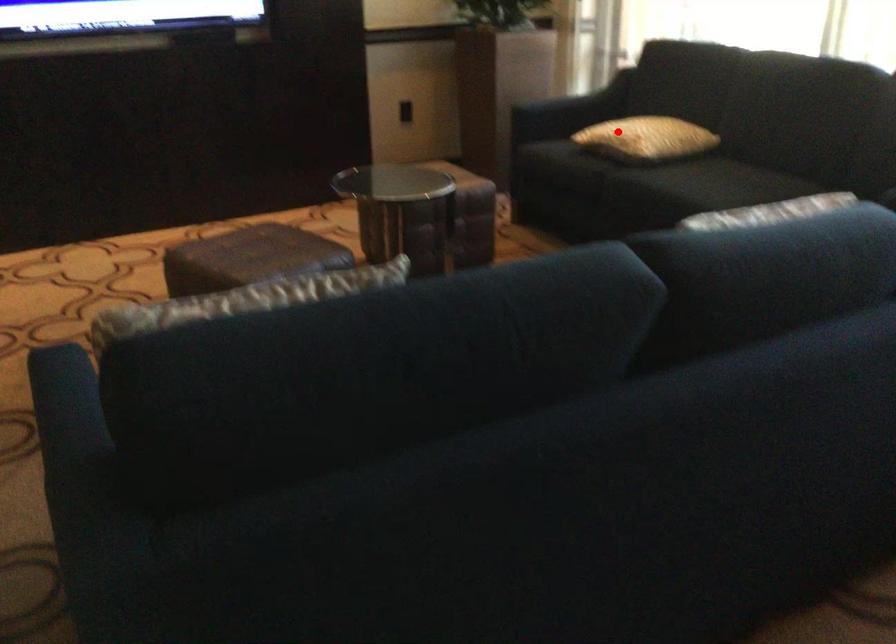
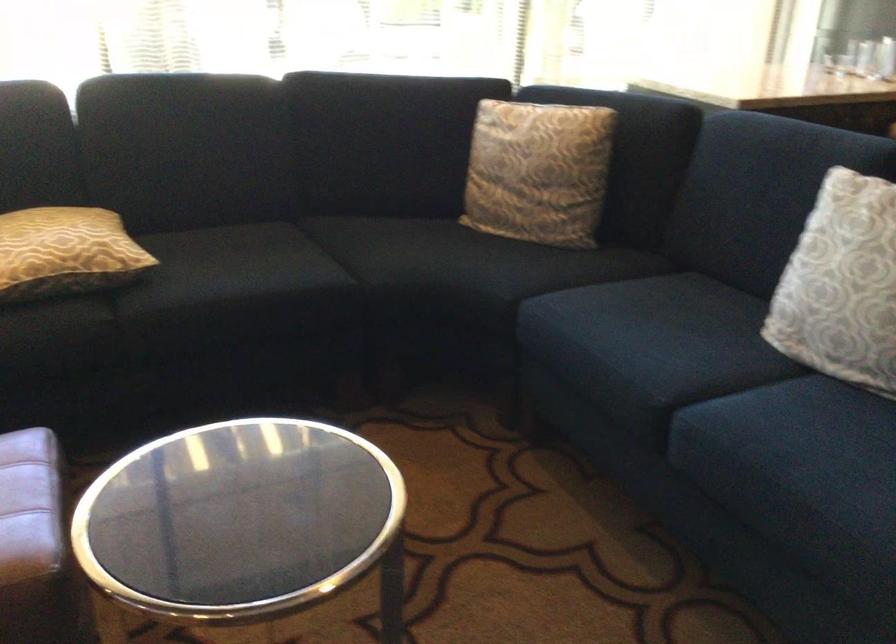
Where in the second image is the point corresponding to the highlighted location from the first image?

(65, 252)